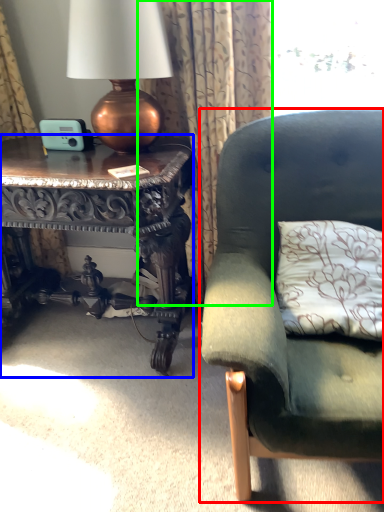
Question: Considering the real-world distances, which object is closest to studio couch (highlighted by a red box)? table (highlighted by a blue box) or curtain (highlighted by a green box).

Choices:
 (A) table
 (B) curtain

Answer: (B)